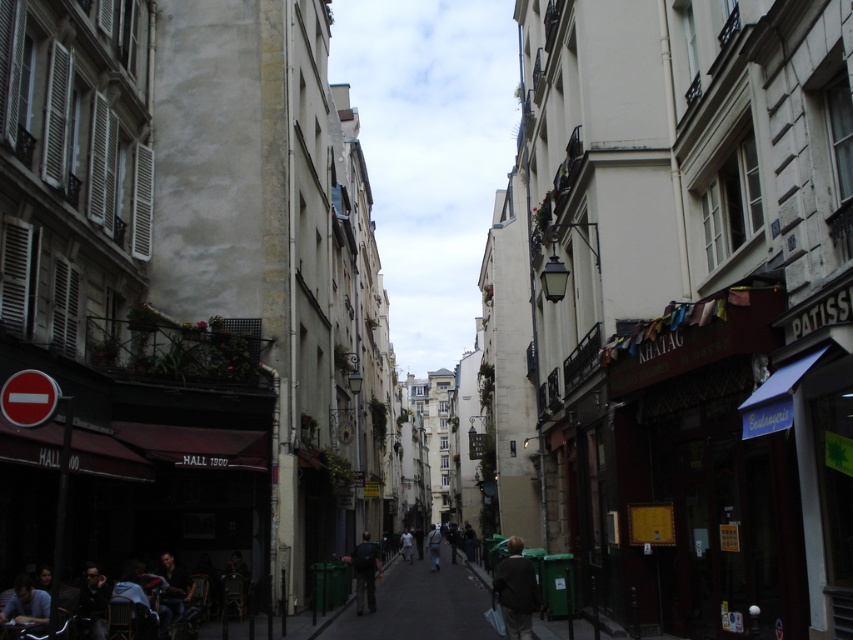
Which of these two, dark brown leather jacket at center or light gray fabric jacket at center, stands shorter?

dark brown leather jacket at center

Describe the element at coordinates (515, 589) in the screenshot. I see `dark brown leather jacket at center` at that location.

Describe the element at coordinates (515, 589) in the screenshot. I see `dark brown leather jacket at center` at that location.

You are a GUI agent. You are given a task and a screenshot of the screen. Output one action in this format:
    pyautogui.click(x=<x>, y=<y>)
    Task: Click on the dark brown leather jacket at center
    The height and width of the screenshot is (640, 853).
    Given the screenshot: What is the action you would take?
    pyautogui.click(x=515, y=589)

Does point (7, 620) come behind point (169, 593)?

No.

Is dark brown leather jacket at lower left positioned before dark blue jeans at lower left?

Yes, it is.

What do you see at coordinates (26, 605) in the screenshot? I see `dark brown leather jacket at lower left` at bounding box center [26, 605].

The image size is (853, 640). What are the coordinates of `dark brown leather jacket at lower left` in the screenshot? It's located at (26, 605).

Which of these two, dark gray fabric jacket at center or white matte person at center, stands taller?

white matte person at center is taller.

Locate an element on the screen. dark gray fabric jacket at center is located at coordinates (364, 572).